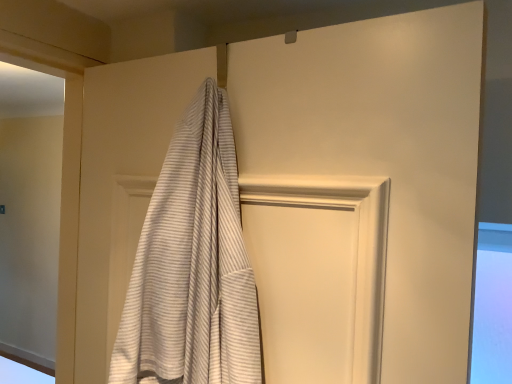
Describe the element at coordinates (192, 266) in the screenshot. I see `white striped towel at center` at that location.

Find the location of a particular element. white striped towel at center is located at coordinates (192, 266).

Identify the location of white striped towel at center. The width and height of the screenshot is (512, 384). (192, 266).